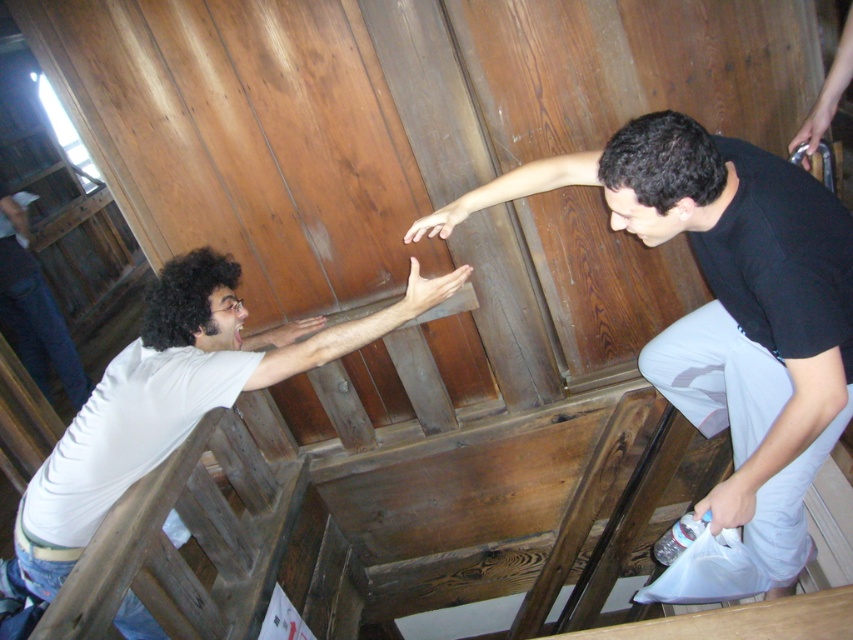
Question: Considering the real-world distances, which object is farthest from the white matte shirt at left?

Choices:
 (A) white matte shirt at lower left
 (B) black matte shirt at upper right

Answer: (A)

Question: Is white matte shirt at left positioned at the back of white matte shirt at lower left?

Choices:
 (A) yes
 (B) no

Answer: (B)

Question: Can you confirm if black matte shirt at upper right is positioned to the left of white matte shirt at left?

Choices:
 (A) no
 (B) yes

Answer: (A)

Question: Among these points, which one is farthest from the camera?

Choices:
 (A) (33, 356)
 (B) (53, 461)
 (C) (750, 250)

Answer: (A)

Question: Does black matte shirt at upper right appear on the right side of white matte shirt at lower left?

Choices:
 (A) yes
 (B) no

Answer: (A)

Question: Which point is farther to the camera?

Choices:
 (A) (140, 385)
 (B) (762, 428)
 (C) (48, 301)

Answer: (C)